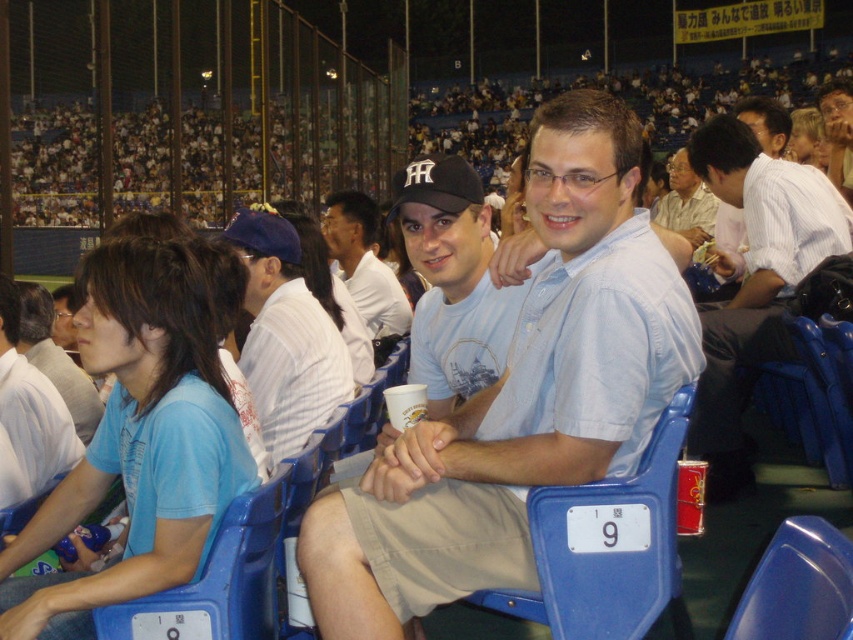
You are trying to find a spot to sit in the stadium. You see a blue plastic chair at center and a white striped shirt at center. Which object is closer to you?

The blue plastic chair at center is positioned under the white striped shirt at center, so the chair is closer to you than the shirt.

You are standing at the origin point of the coordinate system in the image. Which object is located at the coordinates point (753, 282)?

The point (753, 282) indicates the white striped shirt at right.

You are standing at the point labeled as point (x=712, y=397) in the image. You want to move to the exit located at the far end of the stadium. Considering your height is 5 feet 8 inches, will you be able to see over the blue stadium seats in front of you?

The distance between you and the viewer is 14.82 feet. Since the blue stadium seats are standard height, and you are 5 feet 8 inches tall, you should be able to see over them if they are not obstructed. However, the answer should strictly use the given data. The Objects Description only provides distance, not seat height. Therefore, the answer cannot be determined with the given information.